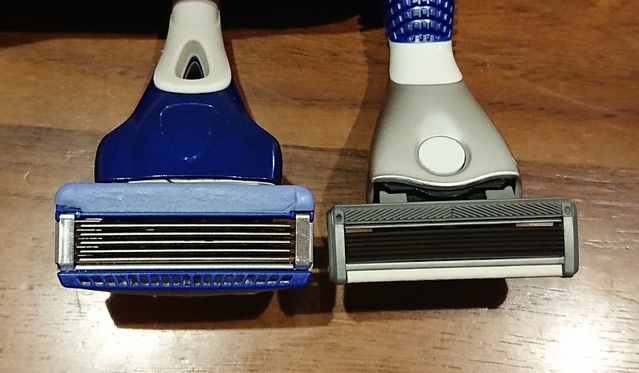
This screenshot has width=639, height=373. In order to click on floor in this screenshot , I will do `click(526, 102)`.